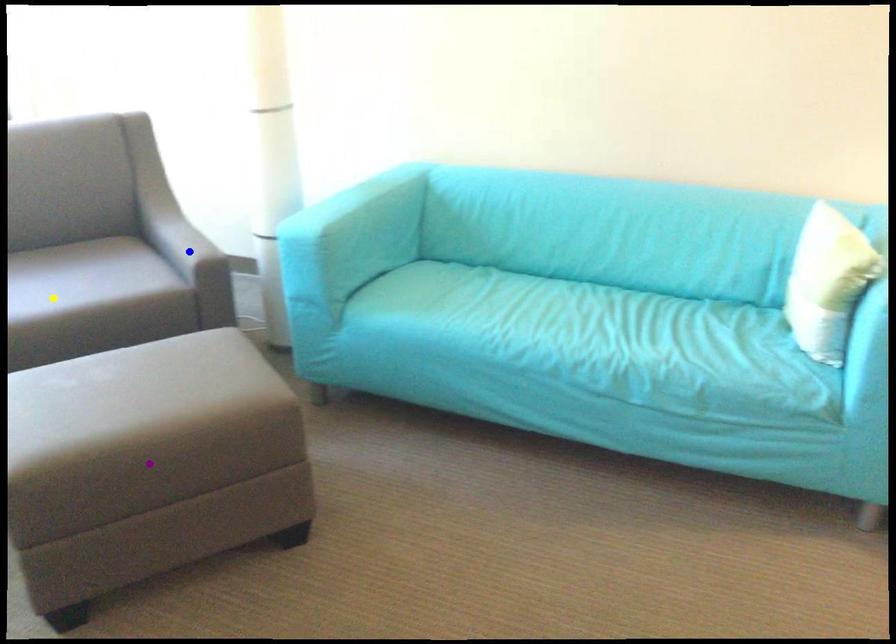
Order these from nearest to farthest:
purple point | yellow point | blue point

blue point, yellow point, purple point